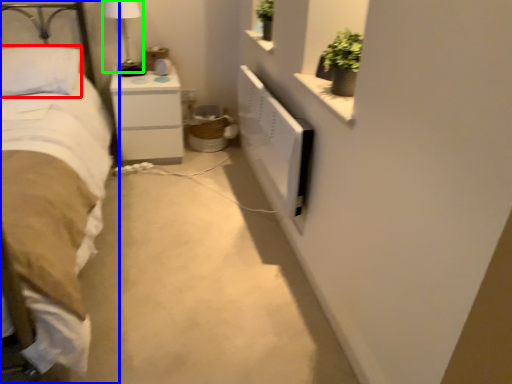
Question: Estimate the real-world distances between objects in this image. Which object is closer to pillow (highlighted by a red box), bed (highlighted by a blue box) or bedside lamp (highlighted by a green box)?

Choices:
 (A) bed
 (B) bedside lamp

Answer: (A)